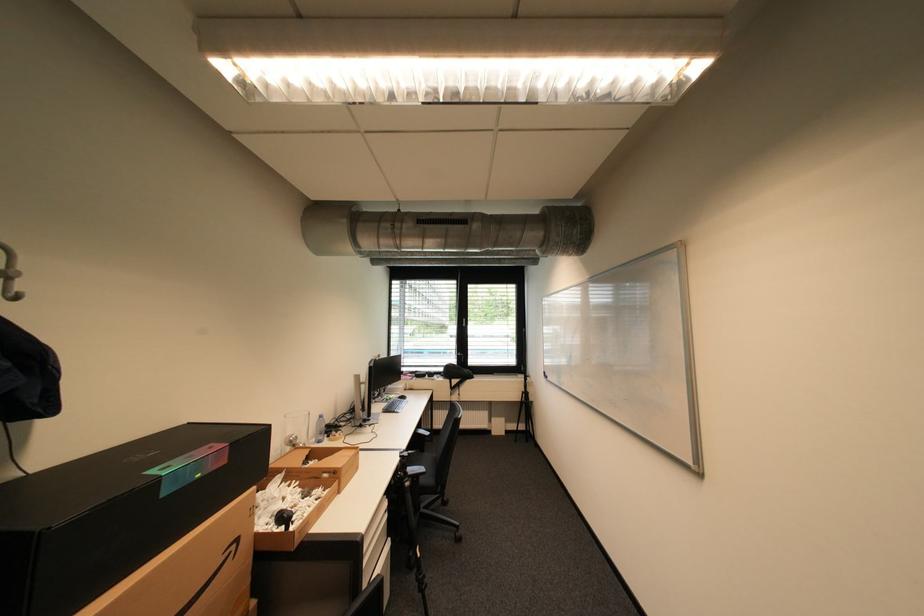
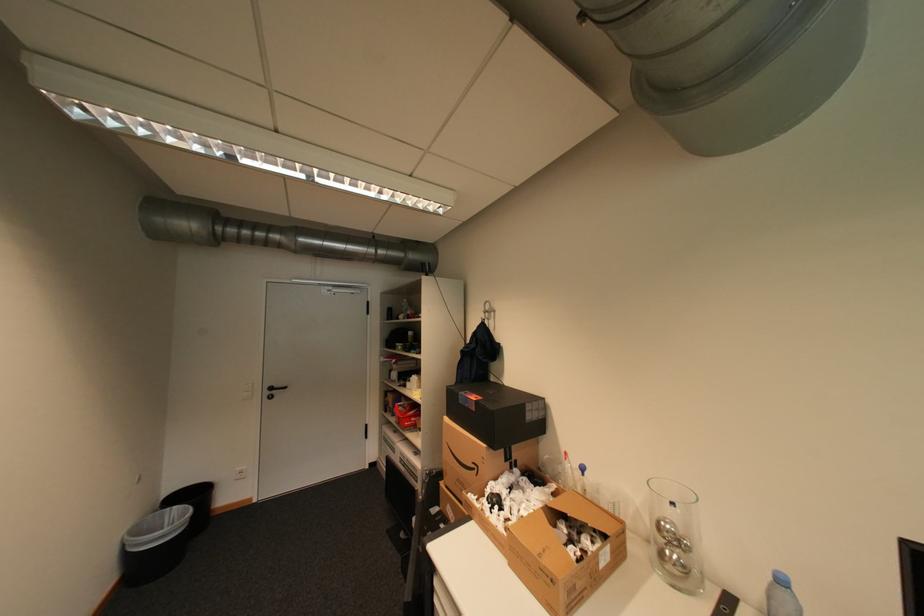
The point at (x=242, y=546) is marked in the first image. Where is the corresponding point in the second image?

(484, 468)